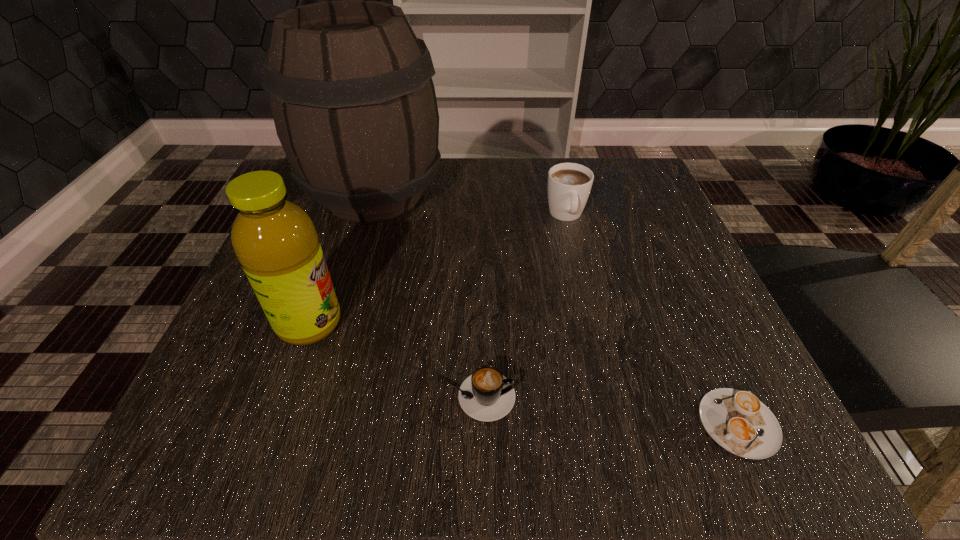
Where is `vacant area that lies between the third nearest object and the second tallest cappuccino`? This screenshot has height=540, width=960. vacant area that lies between the third nearest object and the second tallest cappuccino is located at coordinates (393, 360).

Where is `free space that is in between the second tallest cappuccino and the wine bucket`? This screenshot has height=540, width=960. free space that is in between the second tallest cappuccino and the wine bucket is located at coordinates (425, 295).

This screenshot has width=960, height=540. I want to click on vacant area that lies between the third farthest object and the rightmost cappuccino, so click(x=524, y=373).

You are a GUI agent. You are given a task and a screenshot of the screen. Output one action in this format:
    pyautogui.click(x=<x>, y=<y>)
    Task: Click on the empty space between the third nearest object and the rightmost object
    This screenshot has height=540, width=960.
    Given the screenshot: What is the action you would take?
    pos(524,373)

Where is `vacant space that's between the second object from right to left and the shortest cappuccino`? This screenshot has width=960, height=540. vacant space that's between the second object from right to left and the shortest cappuccino is located at coordinates (653, 319).

The image size is (960, 540). I want to click on unoccupied area between the wine bucket and the leftmost cappuccino, so click(x=425, y=295).

Locate an element on the screen. This screenshot has width=960, height=540. object that is the closest one to the tallest object is located at coordinates [275, 240].

Identify the location of object that ranks as the fourth closest to the wine bucket. This screenshot has height=540, width=960. (738, 421).

Locate an element on the screen. cappuccino that can be found as the closest to the third object from right to left is located at coordinates (738, 421).

Locate an element on the screen. This screenshot has height=540, width=960. cappuccino that can be found as the closest to the third nearest object is located at coordinates (486, 395).